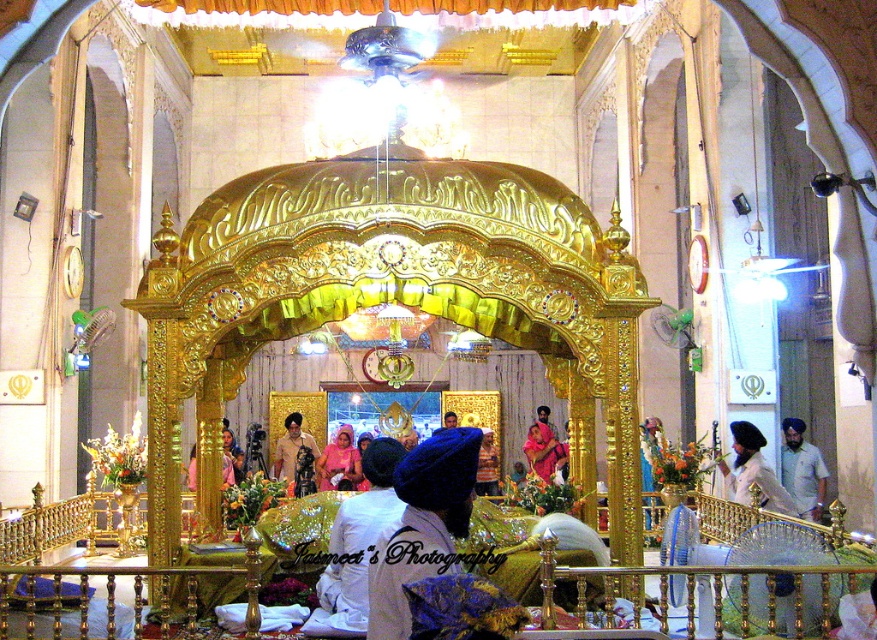
Which of these two, blue fabric turban at center or matte blue turban at center, stands taller?

Standing taller between the two is blue fabric turban at center.

Who is more forward, (807, 465) or (533, 461)?

Point (807, 465) is more forward.

Image resolution: width=877 pixels, height=640 pixels. I want to click on blue fabric turban at center, so click(x=802, y=470).

I want to click on blue fabric turban at center, so click(802, 470).

Does matte white turban at center have a larger size compared to blue fabric turban at center?

No, matte white turban at center is not bigger than blue fabric turban at center.

Is matte white turban at center taller than blue fabric turban at center?

Incorrect, matte white turban at center's height is not larger of blue fabric turban at center's.

Is point (736, 422) farther from camera compared to point (816, 456)?

That is False.

At what (x,y) coordinates should I click in order to perform the action: click on matte white turban at center. Please return your answer as a coordinate pair (x, y). The image size is (877, 640). Looking at the image, I should click on (753, 472).

Is light brown fabric turban at center further to the viewer compared to matte pink dress at center?

No, it is not.

Does light brown fabric turban at center have a smaller size compared to matte pink dress at center?

No, light brown fabric turban at center is not smaller than matte pink dress at center.

Measure the distance between light brown fabric turban at center and camera.

They are 101.15 meters apart.

Where is `light brown fabric turban at center`? The width and height of the screenshot is (877, 640). light brown fabric turban at center is located at coordinates (296, 456).